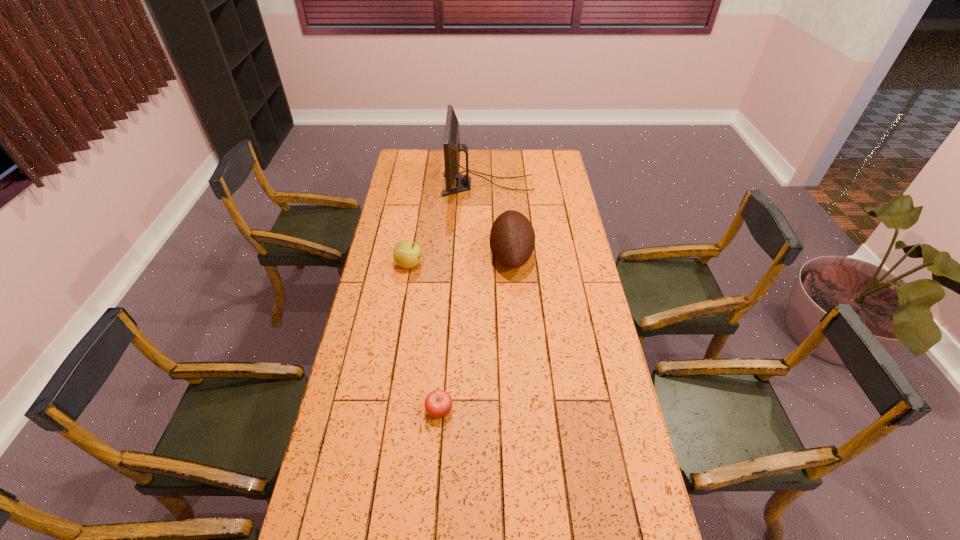
Locate an element on the screen. computer monitor is located at coordinates (452, 147).

Identify the location of the farthest object. (452, 147).

What are the coordinates of `the second tallest object` in the screenshot? It's located at (512, 238).

Find the location of a particular element. Image resolution: width=960 pixels, height=540 pixels. the third tallest object is located at coordinates (407, 254).

The height and width of the screenshot is (540, 960). I want to click on softball, so click(x=407, y=254).

Locate an element on the screen. This screenshot has height=540, width=960. apple is located at coordinates (438, 403).

Where is `the nearest object`? This screenshot has height=540, width=960. the nearest object is located at coordinates (438, 403).

Locate an element on the screen. The width and height of the screenshot is (960, 540). free space located on the screen side of the computer monitor is located at coordinates (423, 184).

Identify the location of vacant space positioned on the screen side of the computer monitor. The height and width of the screenshot is (540, 960). (409, 184).

Where is `vacant space located on the screen side of the computer monitor`? vacant space located on the screen side of the computer monitor is located at coordinates (429, 184).